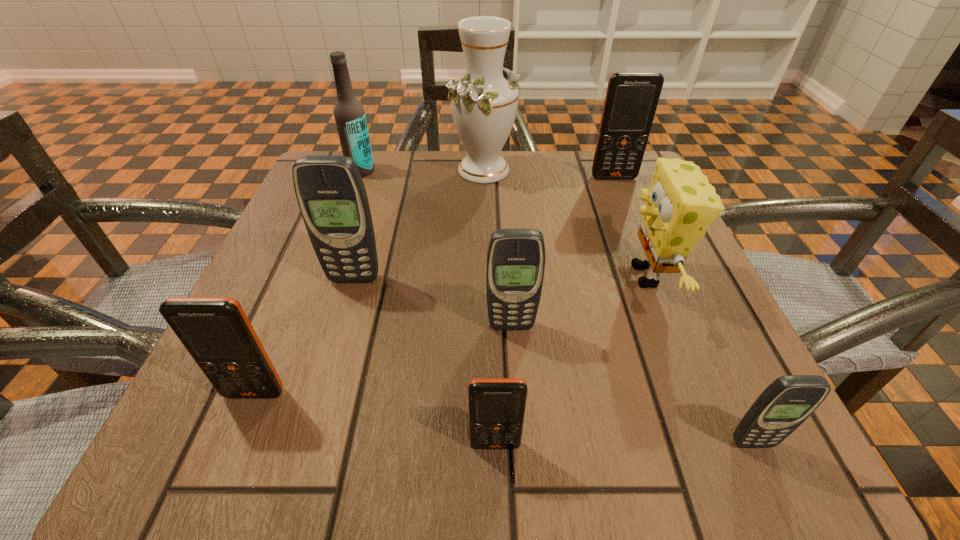
This screenshot has width=960, height=540. I want to click on free space between the leftmost orange cellular telephone and the farthest cellular telephone, so click(x=434, y=285).

I want to click on vacant space that is in between the second smallest orange cellular telephone and the rightmost orange cellular telephone, so click(434, 285).

This screenshot has height=540, width=960. In order to click on vacant point located between the farthest orange cellular telephone and the second smallest orange cellular telephone in this screenshot , I will do `click(434, 285)`.

Where is `blank region between the beer bottle and the smallest orange cellular telephone`? blank region between the beer bottle and the smallest orange cellular telephone is located at coordinates (428, 307).

Identify which object is the third closest to the farthest gray cellular telephone. Please provide its 2D coordinates. Your answer should be formatted as a tuple, i.e. [(x, y)], where the tuple contains the x and y coordinates of a point satisfying the conditions above.

[(484, 102)]

The height and width of the screenshot is (540, 960). What are the coordinates of `object that is the seventh closest one to the beer bottle` in the screenshot? It's located at (497, 406).

Locate an element on the screen. Image resolution: width=960 pixels, height=540 pixels. cellular telephone that stands as the second closest to the sponge is located at coordinates (787, 402).

Select which cellular telephone is the closest to the beer bottle. Please provide its 2D coordinates. Your answer should be formatted as a tuple, i.e. [(x, y)], where the tuple contains the x and y coordinates of a point satisfying the conditions above.

[(331, 195)]

At what (x,y) coordinates should I click in order to perform the action: click on orange cellular telephone that stands as the closest to the rightmost orange cellular telephone. Please return your answer as a coordinate pair (x, y). Looking at the image, I should click on coord(497,406).

The image size is (960, 540). I want to click on orange cellular telephone that is the third closest one to the nearest gray cellular telephone, so click(631, 100).